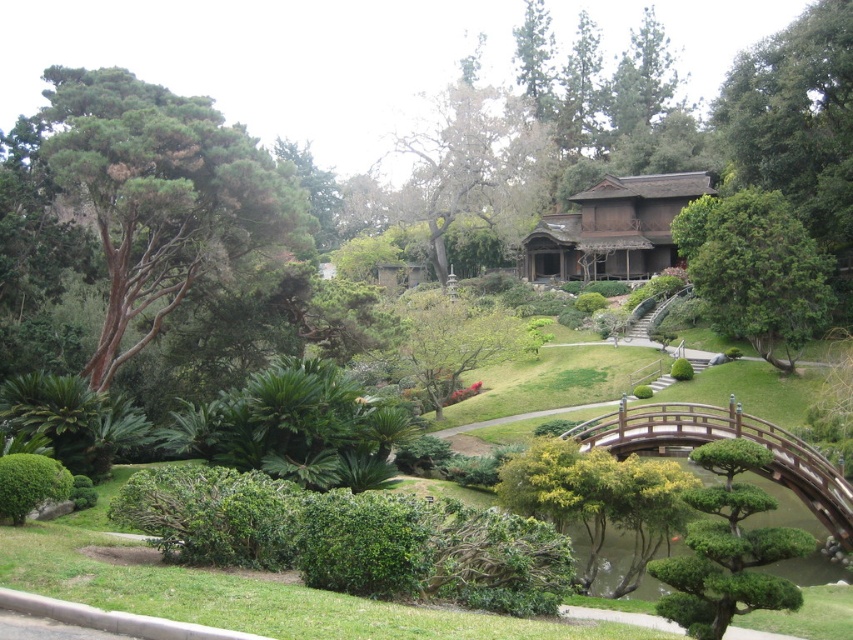
Question: Which point is farther from the camera taking this photo?

Choices:
 (A) (747, 198)
 (B) (213, 131)
 (C) (691, 444)

Answer: (A)

Question: Does green textured tree at left have a greater width compared to green leafy tree at center?

Choices:
 (A) yes
 (B) no

Answer: (A)

Question: Which of these objects is positioned closest to the wooden bridge at center-right?

Choices:
 (A) green textured tree at left
 (B) green leafy tree at center

Answer: (B)

Question: Observing the image, what is the correct spatial positioning of green leafy tree at center in reference to wooden bridge at center-right?

Choices:
 (A) above
 (B) below

Answer: (A)

Question: Considering the relative positions of green leafy tree at center and wooden bridge at center-right in the image provided, where is green leafy tree at center located with respect to wooden bridge at center-right?

Choices:
 (A) below
 (B) above

Answer: (B)

Question: Among these points, which one is farthest from the camera?

Choices:
 (A) (820, 296)
 (B) (204, 192)

Answer: (A)